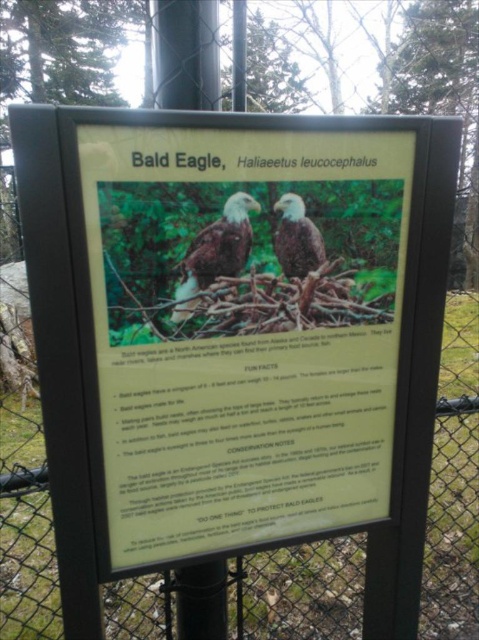
Does brown feathered eagle at center have a greater height compared to matte brown eagle at center?

Yes.

Who is taller, brown feathered eagle at center or matte brown eagle at center?

brown feathered eagle at center is taller.

The height and width of the screenshot is (640, 479). I want to click on brown feathered eagle at center, so click(216, 252).